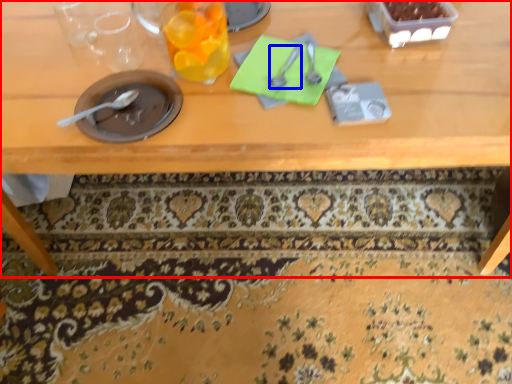
Question: Among these objects, which one is farthest to the camera, table (highlighted by a red box) or tableware (highlighted by a blue box)?

Choices:
 (A) table
 (B) tableware

Answer: (B)